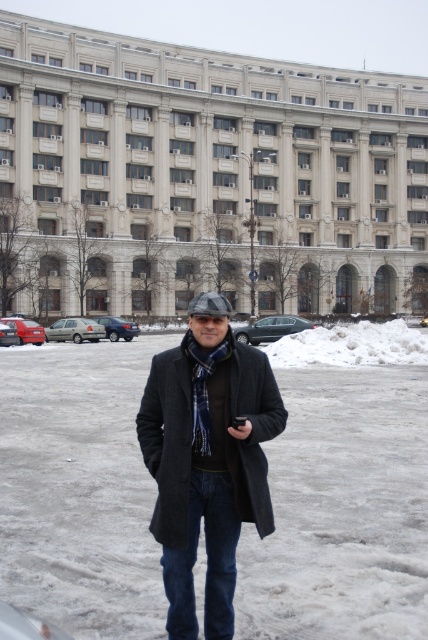
Question: Does white fluffy snow at lower right have a lesser width compared to yellow plastic car at center?

Choices:
 (A) no
 (B) yes

Answer: (A)

Question: Which object is farther from the camera taking this photo?

Choices:
 (A) satin silver sedan at left
 (B) white fluffy snow at lower right

Answer: (A)

Question: Among these points, which one is nearest to the camera?

Choices:
 (A) (128, 337)
 (B) (11, 317)

Answer: (B)

Question: Among these points, which one is farthest from the camera?

Choices:
 (A) (32, 330)
 (B) (68, 323)
 (C) (247, 333)
 (D) (133, 330)

Answer: (D)

Question: Does white fluffy snow at center have a greater width compared to blue plaid scarf at center?

Choices:
 (A) yes
 (B) no

Answer: (A)

Question: Is blue plaid scarf at center above blue metallic sedan at center?

Choices:
 (A) no
 (B) yes

Answer: (A)